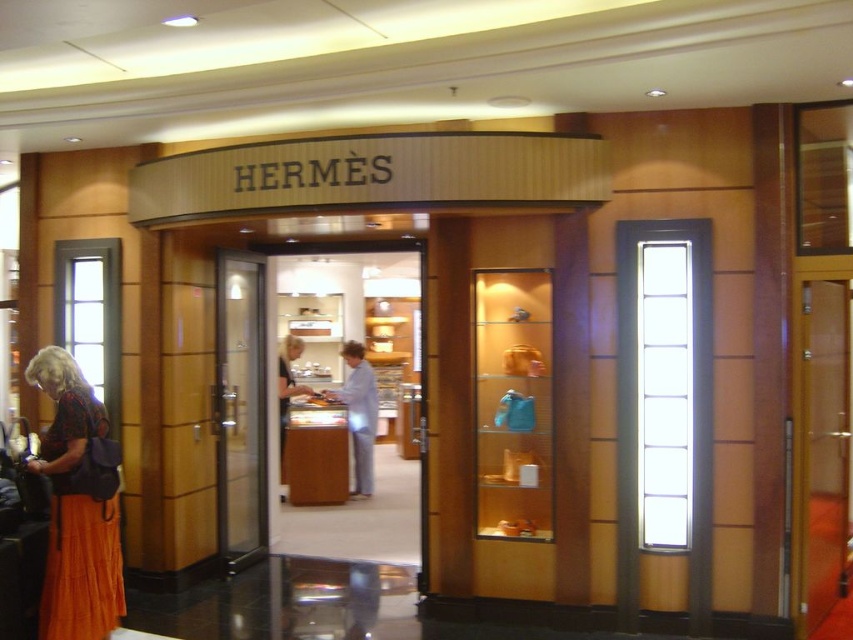
Question: Among these objects, which one is farthest from the camera?

Choices:
 (A) light beige fabric jacket at center
 (B) light blue fabric shirt at center
 (C) transparent glass door at center

Answer: (B)

Question: Can you confirm if orange skirt at lower left is positioned above transparent glass door at center?

Choices:
 (A) yes
 (B) no

Answer: (B)

Question: Does light blue fabric shirt at center have a greater width compared to light beige fabric jacket at center?

Choices:
 (A) no
 (B) yes

Answer: (B)

Question: Which of the following is the farthest from the observer?

Choices:
 (A) (289, 396)
 (B) (416, 307)
 (C) (369, 493)

Answer: (B)

Question: Is orange skirt at lower left further to the viewer compared to light blue fabric shirt at center?

Choices:
 (A) no
 (B) yes

Answer: (A)

Question: Which object is the closest to the wooden counter at center?

Choices:
 (A) orange skirt at lower left
 (B) transparent glass door at center

Answer: (B)